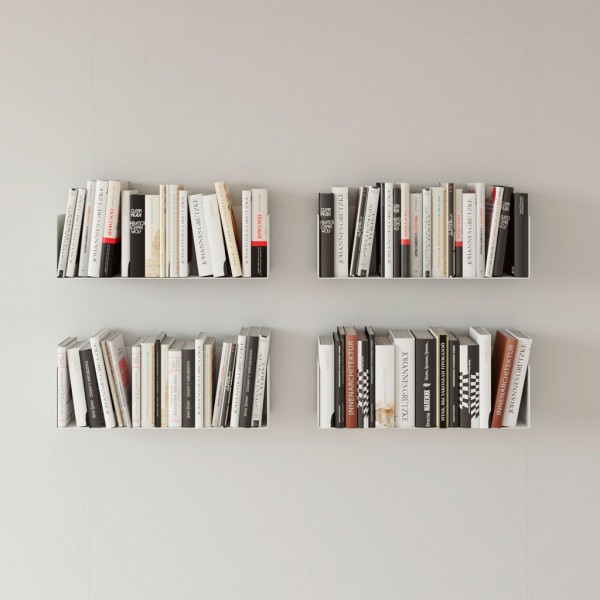
Where is `book shelf`? book shelf is located at coordinates (200, 274), (213, 425), (386, 276), (384, 428).